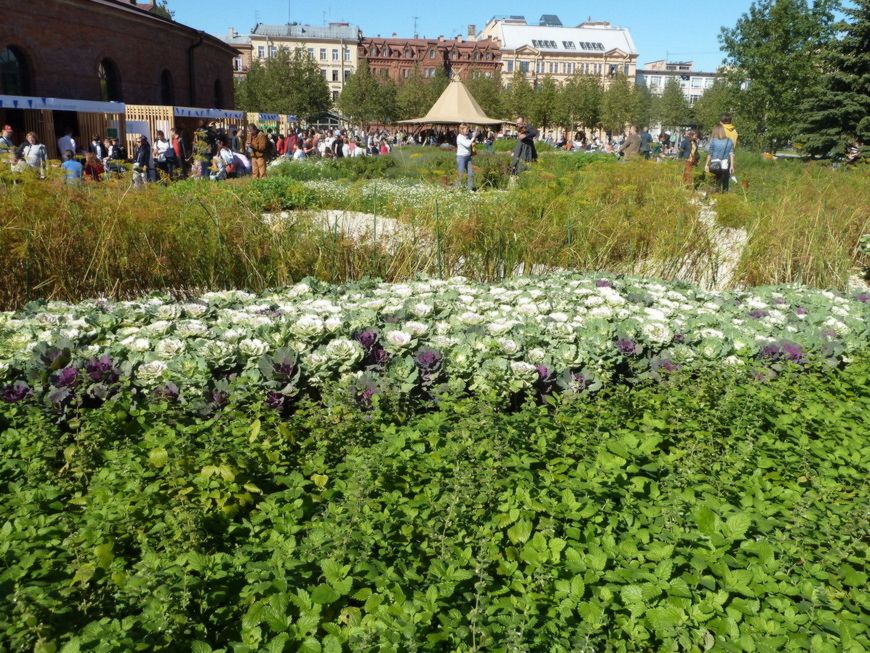
Locate an element on the screen. The width and height of the screenshot is (870, 653). arched windows is located at coordinates (104, 67), (4, 78), (159, 78), (218, 91).